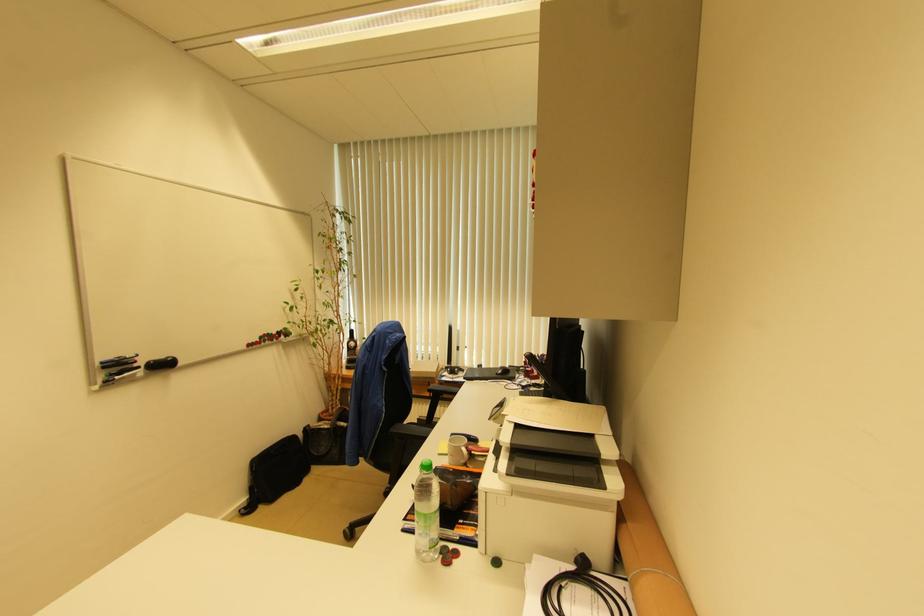
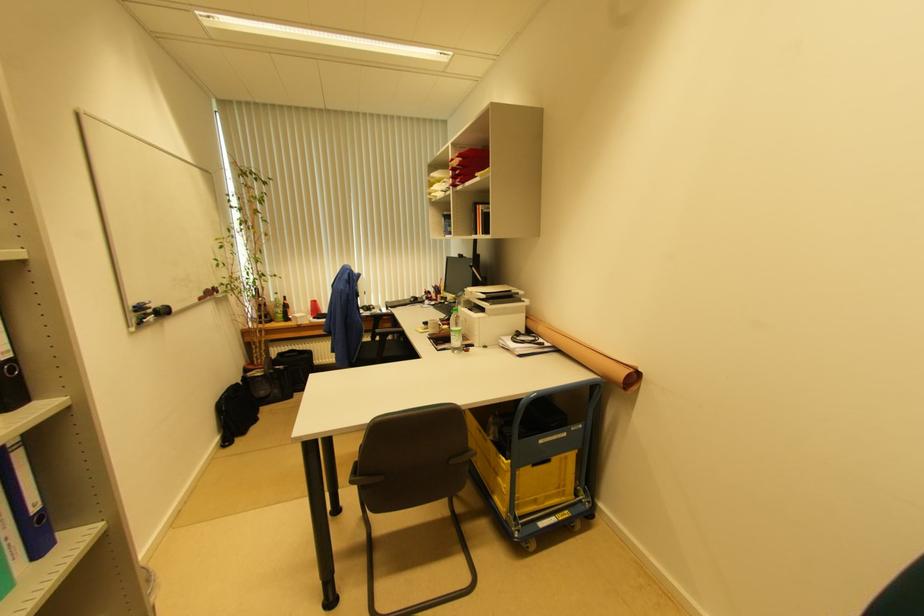
Where in the second image is the point corresponding to point 305,434 from the first image?

(242, 383)